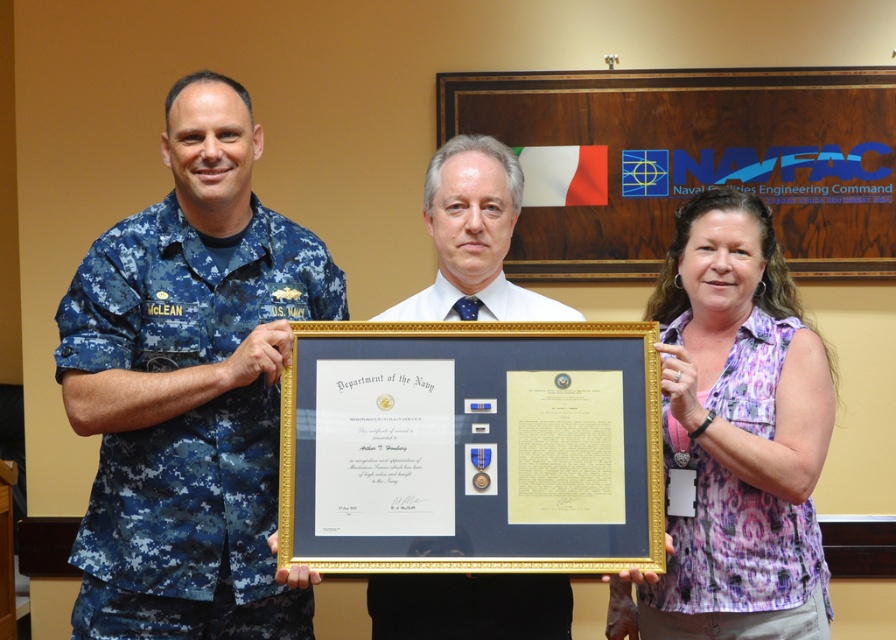
You are an event photographer at the NAVFAC Europe Africa Southwest Asia facility. You need to ensure that all attendees are properly framed in the photo. Given the presence of the digital camouflage uniform at left and the purple printed shirt at center, which attendee occupies more horizontal space in the photo?

The digital camouflage uniform at left occupies more horizontal space in the photo because its width is larger than the purple printed shirt at center.

You are an observer standing in front of the NAVFAC backdrop. You notice two people in the scene wearing different uniforms. The person in the digital camouflage uniform at left and the person in the blue fabric uniform at center. Which uniform is wider?

The digital camouflage uniform at left might be wider than blue fabric uniform at center according to the description.

You are a photographer standing in front of the scene. You want to take a closeup photo of the framed certificate held by the individuals. Which of the two points, point (183, 602) or point (415, 307), is closer to you and would allow for a better closeup shot?

Point (183, 602) is closer to the viewer than point (415, 307), so it would allow for a better closeup shot.